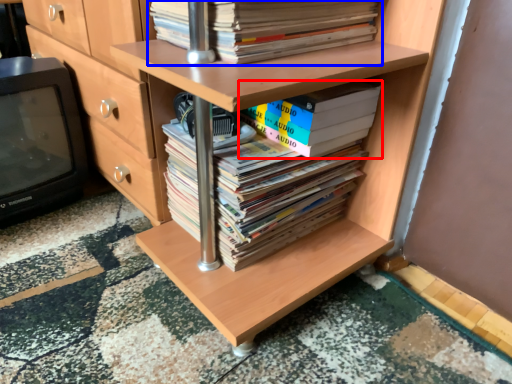
Question: Which point is closer to the camera, book (highlighted by a red box) or book (highlighted by a blue box)?

Choices:
 (A) book
 (B) book

Answer: (B)